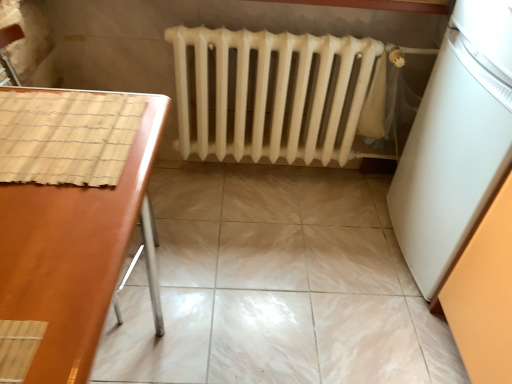
What do you see at coordinates (270, 93) in the screenshot?
I see `white matte radiator at center` at bounding box center [270, 93].

Where is `white matte radiator at center`? white matte radiator at center is located at coordinates (270, 93).

In order to face white matte refrigerator at right, should I rotate leftwards or rightwards?

Rotate right and turn 31.760 degrees.

Image resolution: width=512 pixels, height=384 pixels. Find the location of `white matte radiator at center`. white matte radiator at center is located at coordinates (270, 93).

Is white matte refrigerator at right shorter than white matte radiator at center?

No.

Looking at their sizes, would you say white matte refrigerator at right is wider or thinner than white matte radiator at center?

Clearly, white matte refrigerator at right has more width compared to white matte radiator at center.

Can you tell me how much white matte refrigerator at right and white matte radiator at center differ in facing direction?

89.9 degrees separate the facing orientations of white matte refrigerator at right and white matte radiator at center.

Is white matte refrigerator at right outside of white matte radiator at center?

Yes, white matte refrigerator at right is not within white matte radiator at center.

From the image's perspective, is white matte radiator at center above or below white matte refrigerator at right?

white matte radiator at center is above white matte refrigerator at right.

Choose the correct answer: Is white matte radiator at center inside white matte refrigerator at right or outside it?

white matte radiator at center is not inside white matte refrigerator at right, it's outside.

Where is `appliance above the white matte radiator at center (from a real-world perspective)`? appliance above the white matte radiator at center (from a real-world perspective) is located at coordinates (455, 141).

Considering the relative positions of white matte radiator at center and white matte refrigerator at right in the image provided, is white matte radiator at center in front of white matte refrigerator at right?

No, white matte radiator at center is behind white matte refrigerator at right.

From a real-world perspective, is marble tile floor at center above or below brown glossy table at left?

Clearly, from a real-world perspective, marble tile floor at center is below brown glossy table at left.

Locate an element on the screen. furniture in front of the marble tile floor at center is located at coordinates (68, 221).

Does marble tile floor at center contain brown glossy table at left?

No, brown glossy table at left is not a part of marble tile floor at center.

Which of these two, marble tile floor at center or brown glossy table at left, is bigger?

Bigger between the two is brown glossy table at left.

The height and width of the screenshot is (384, 512). Identify the location of ceramic tile on the left side of white matte refrigerator at right. (275, 285).

How far apart are white matte refrigerator at right and marble tile floor at center?

white matte refrigerator at right is 54.72 centimeters from marble tile floor at center.

Consider the image. Which of these two, white matte refrigerator at right or marble tile floor at center, is bigger?

With larger size is white matte refrigerator at right.

Is marble tile floor at center at the back of white matte refrigerator at right?

No.

From a real-world perspective, who is located lower, brown glossy table at left or white matte radiator at center?

white matte radiator at center is physically lower.

Consider the image. Would you say white matte radiator at center is part of brown glossy table at left's contents?

No, white matte radiator at center is located outside of brown glossy table at left.

Is brown glossy table at left taller or shorter than white matte radiator at center?

Considering their sizes, brown glossy table at left has more height than white matte radiator at center.

Is brown glossy table at left oriented away from white matte radiator at center?

No.

Can you tell me how much brown glossy table at left and white matte refrigerator at right differ in facing direction?

180 degrees separate the facing orientations of brown glossy table at left and white matte refrigerator at right.

Is brown glossy table at left bigger or smaller than white matte refrigerator at right?

Considering their sizes, brown glossy table at left takes up less space than white matte refrigerator at right.

Relative to white matte refrigerator at right, is brown glossy table at left in front or behind?

In the image, brown glossy table at left appears in front of white matte refrigerator at right.

Considering the relative sizes of white matte radiator at center and marble tile floor at center in the image provided, is white matte radiator at center thinner than marble tile floor at center?

Yes, white matte radiator at center is thinner than marble tile floor at center.

Considering the positions of objects white matte radiator at center and marble tile floor at center in the image provided, who is more to the right, white matte radiator at center or marble tile floor at center?

Positioned to the right is white matte radiator at center.

Consider the image. Is white matte radiator at center directly adjacent to marble tile floor at center?

white matte radiator at center and marble tile floor at center are not in contact.

Find the location of a particular element. The image size is (512, 384). radiator that is on the right side of marble tile floor at center is located at coordinates (270, 93).

Find the location of a particular element. The width and height of the screenshot is (512, 384). appliance below the white matte radiator at center (from the image's perspective) is located at coordinates (455, 141).

Where is `appliance that appears on the right of white matte radiator at center`? appliance that appears on the right of white matte radiator at center is located at coordinates (455, 141).

From the image, which object appears to be farther from white matte radiator at center, white matte refrigerator at right or marble tile floor at center?

white matte refrigerator at right.

When comparing their distances from brown glossy table at left, does marble tile floor at center or white matte radiator at center seem closer?

Based on the image, white matte radiator at center appears to be nearer to brown glossy table at left.

Looking at the image, which one is located closer to marble tile floor at center, brown glossy table at left or white matte radiator at center?

Based on the image, white matte radiator at center appears to be nearer to marble tile floor at center.

Based on the photo, looking at the image, which one is located closer to white matte radiator at center, marble tile floor at center or white matte refrigerator at right?

The object closer to white matte radiator at center is marble tile floor at center.

Considering their positions, is white matte radiator at center positioned further to marble tile floor at center than brown glossy table at left?

brown glossy table at left is positioned further to the anchor marble tile floor at center.

From the picture: Looking at the image, which one is located further to marble tile floor at center, white matte refrigerator at right or white matte radiator at center?

white matte refrigerator at right is further to marble tile floor at center.

From the image, which object appears to be nearer to white matte radiator at center, brown glossy table at left or marble tile floor at center?

marble tile floor at center.

Looking at the image, which one is located closer to white matte radiator at center, white matte refrigerator at right or brown glossy table at left?

white matte refrigerator at right.

Image resolution: width=512 pixels, height=384 pixels. Find the location of `ceramic tile located between brown glossy table at left and white matte refrigerator at right in the left-right direction`. ceramic tile located between brown glossy table at left and white matte refrigerator at right in the left-right direction is located at coordinates (275, 285).

In order to click on ceramic tile between brown glossy table at left and white matte radiator at center from front to back in this screenshot , I will do `click(275, 285)`.

At what (x,y) coordinates should I click in order to perform the action: click on radiator located between brown glossy table at left and white matte refrigerator at right in the left-right direction. Please return your answer as a coordinate pair (x, y). This screenshot has width=512, height=384. Looking at the image, I should click on (270, 93).

This screenshot has width=512, height=384. Find the location of `radiator situated between marble tile floor at center and white matte refrigerator at right from left to right`. radiator situated between marble tile floor at center and white matte refrigerator at right from left to right is located at coordinates (270, 93).